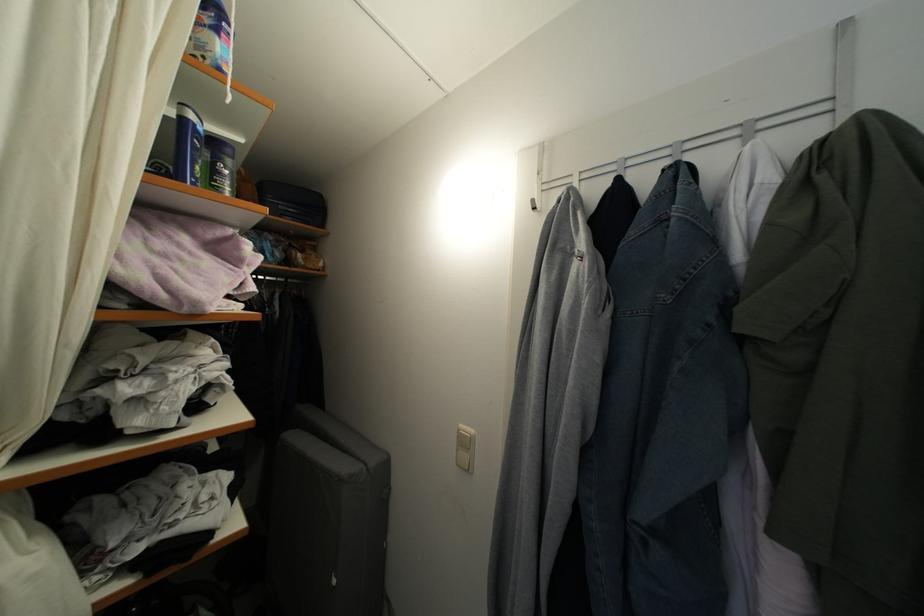
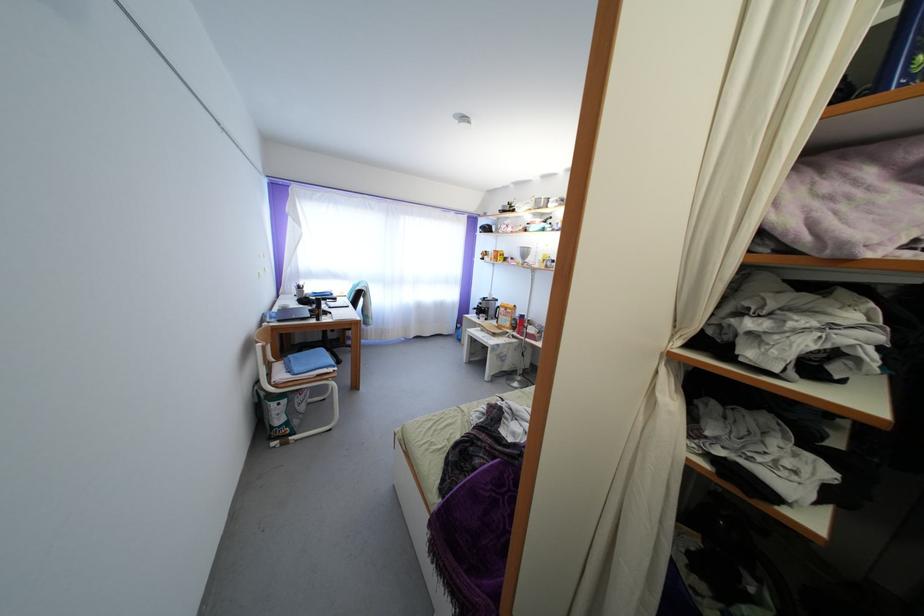
Question: The images are taken continuously from a first-person perspective. In which direction is your viewpoint rotating?

Choices:
 (A) Left
 (B) Right
 (C) Up
 (D) Down

Answer: (A)